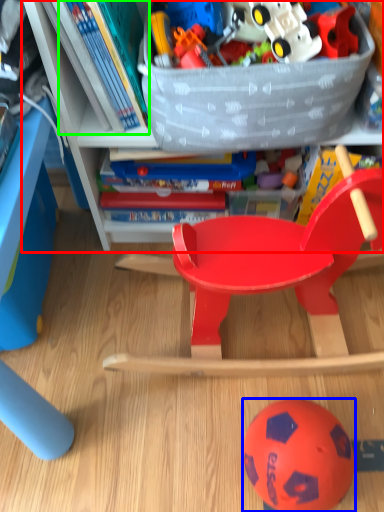
Question: Which object is the farthest from bookcase (highlighted by a red box)? Choose among these: ball (highlighted by a blue box) or book (highlighted by a green box).

Choices:
 (A) ball
 (B) book

Answer: (A)